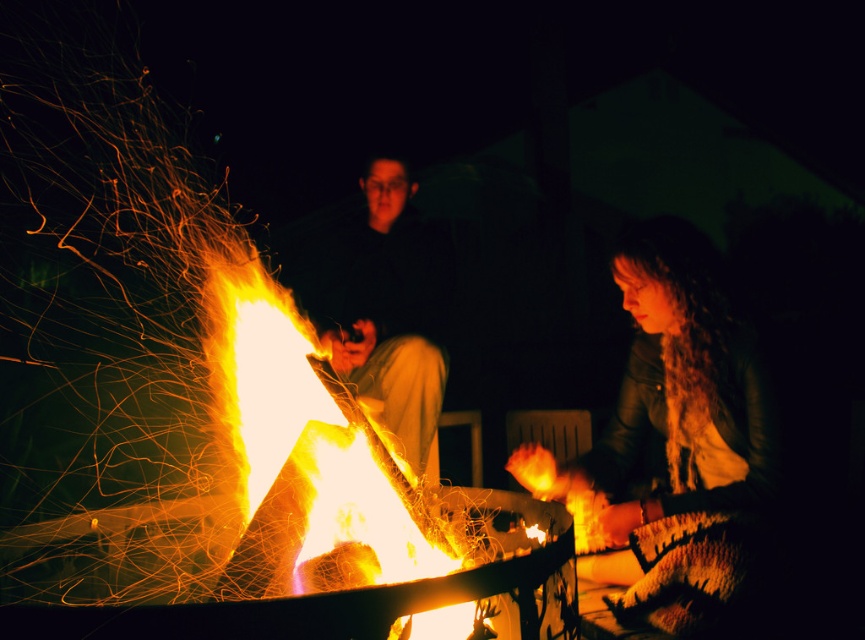
Question: Among these points, which one is nearest to the camera?

Choices:
 (A) (433, 241)
 (B) (620, 504)

Answer: (B)

Question: Is leather jacket at lower right above matte black jacket at center?

Choices:
 (A) no
 (B) yes

Answer: (A)

Question: Can you confirm if leather jacket at lower right is positioned to the right of matte black jacket at center?

Choices:
 (A) no
 (B) yes

Answer: (B)

Question: Which point is farther to the camera?

Choices:
 (A) leather jacket at lower right
 (B) flaming wood at center

Answer: (A)

Question: Can you confirm if leather jacket at lower right is smaller than flaming wood at center?

Choices:
 (A) no
 (B) yes

Answer: (A)

Question: Which object appears farthest from the camera in this image?

Choices:
 (A) matte black jacket at center
 (B) leather jacket at lower right

Answer: (A)